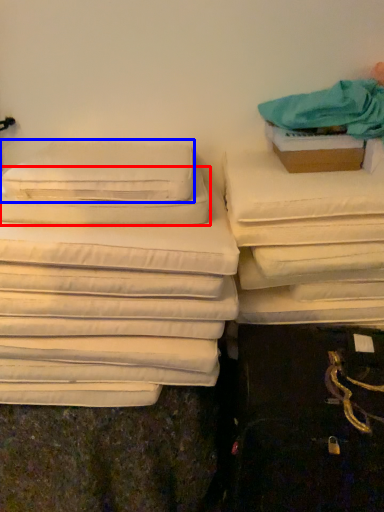
Question: Which of the following is the farthest to the observer, pillow (highlighted by a red box) or pillow (highlighted by a blue box)?

Choices:
 (A) pillow
 (B) pillow

Answer: (B)